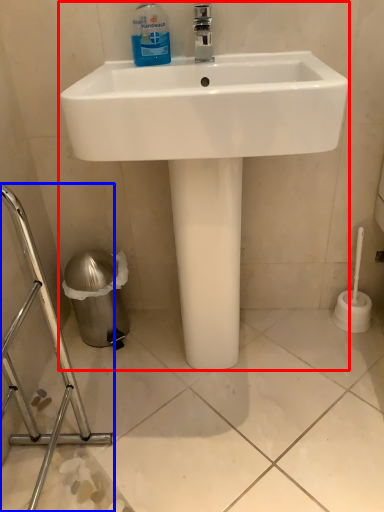
Question: Which object appears farthest to the camera in this image, sink (highlighted by a red box) or porcelain (highlighted by a blue box)?

Choices:
 (A) sink
 (B) porcelain

Answer: (A)